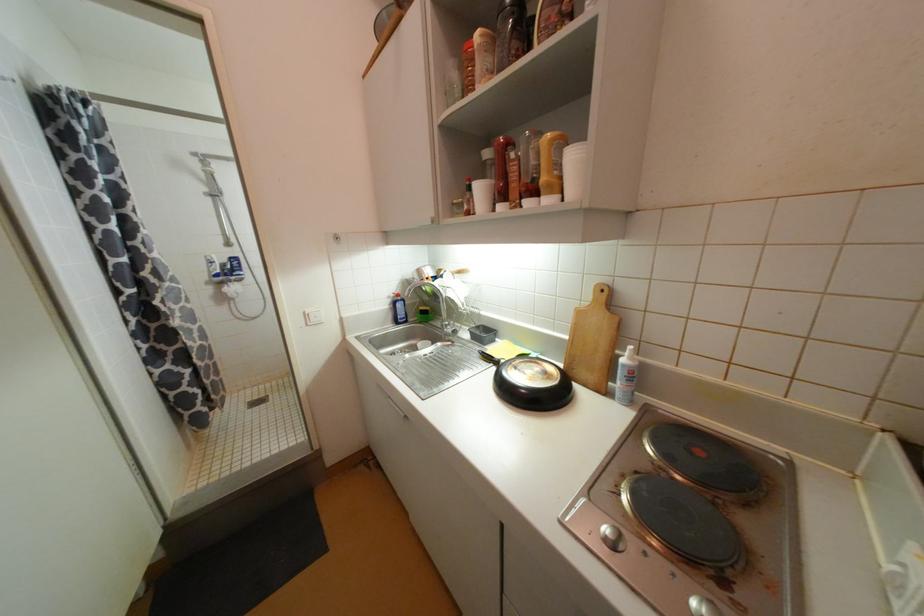
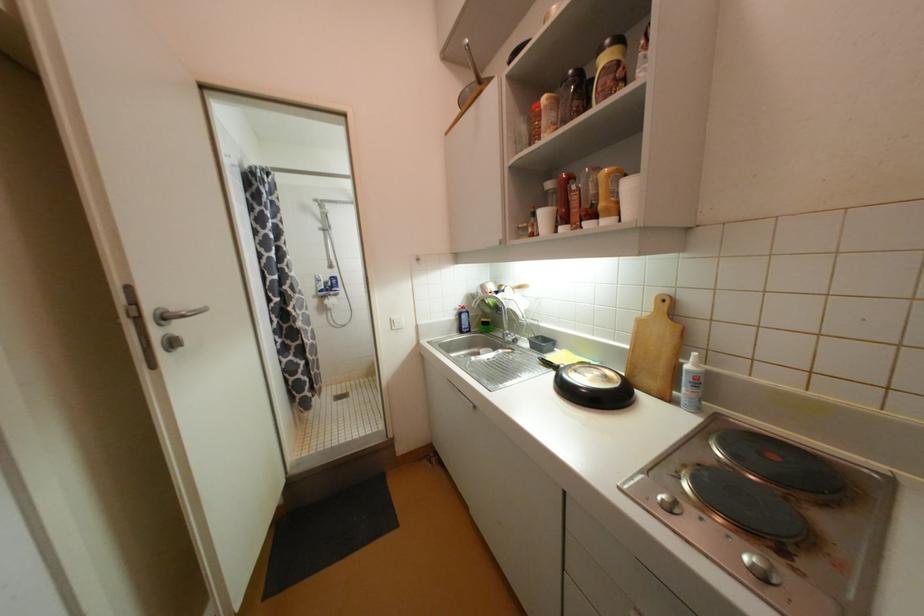
Find the pixel in the second image that matches point (493, 360) in the first image.

(553, 365)